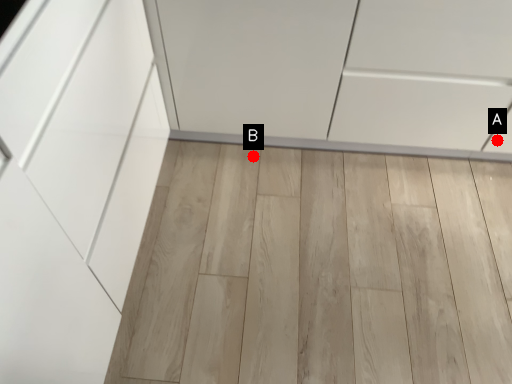
Question: Two points are circled on the image, labeled by A and B beside each circle. Which point is farther from the camera taking this photo?

Choices:
 (A) A is further
 (B) B is further

Answer: (B)